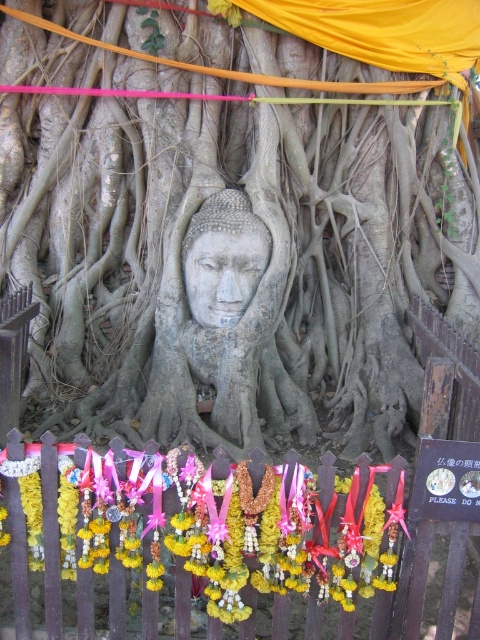
You are a photographer standing in front of the scene. You want to capture a photo where both the yellow fabric garland at lower center and the gray stone buddha head at center are clearly visible. Which object is closer to your camera lens?

The yellow fabric garland at lower center is closer to the viewer than the gray stone buddha head at center, so it will appear closer to the camera lens in the photo.

You are a photographer planning to take a photo of the gray stone buddha head at center and the yellow fabric garland at lower center. To ensure both elements are in focus, you need to know their vertical positions. Which one is positioned lower in the image?

The yellow fabric garland at lower center is positioned below the gray stone buddha head at center, so it is lower in the image.